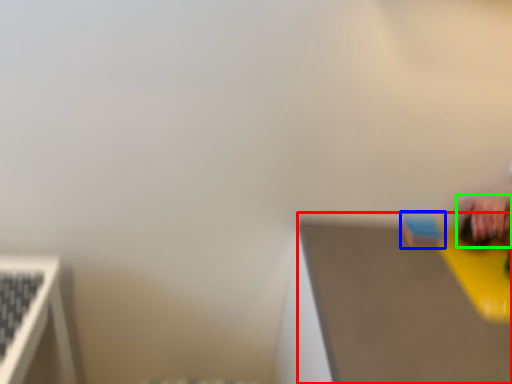
Question: Estimate the real-world distances between objects in this image. Which object is farther from table top (highlighted by a red box), toy (highlighted by a blue box) or toy (highlighted by a green box)?

Choices:
 (A) toy
 (B) toy

Answer: (B)